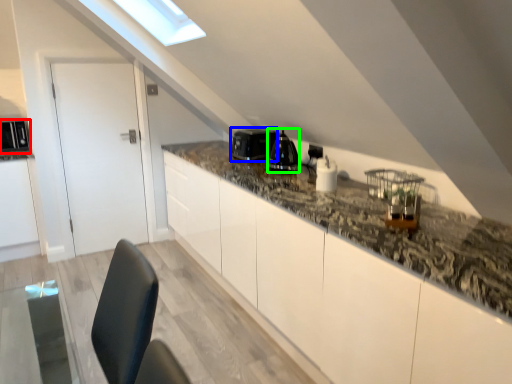
Question: Which object is positioned closest to appliance (highlighted by a red box)? Select from appliance (highlighted by a blue box) and appliance (highlighted by a green box).

Choices:
 (A) appliance
 (B) appliance

Answer: (A)